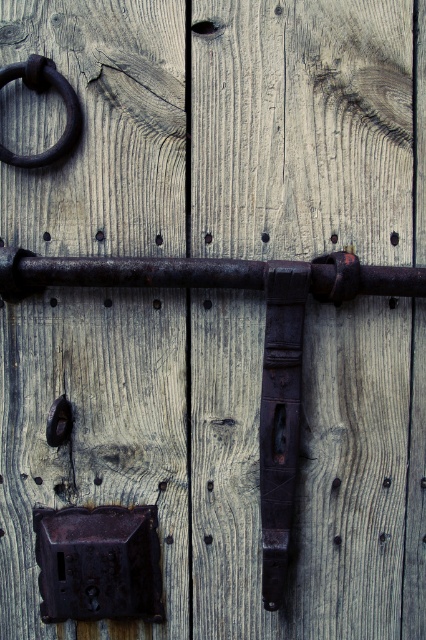
You are a locksmith examining the weathered wooden door. You need to determine which of the two rusty metal components, the rusty metal lock at lower left or the rusty metal ring at upper left, requires more material to repair. Based on their sizes, which one would need more material?

The rusty metal lock at lower left is bigger than the rusty metal ring at upper left, so it would require more material to repair.